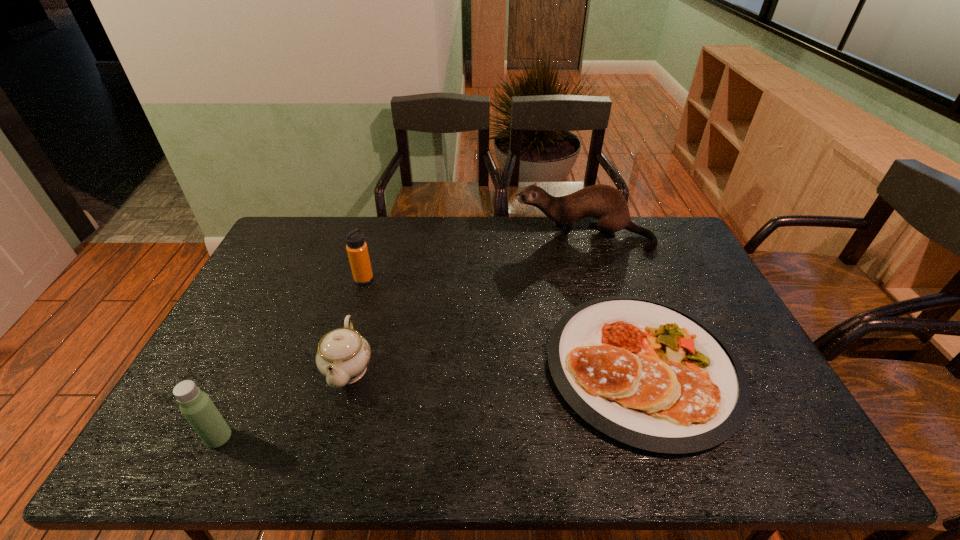
Identify the location of free point between the leftmost object and the ferret. (401, 336).

Locate an element on the screen. The height and width of the screenshot is (540, 960). vacant region between the leftmost object and the shortest object is located at coordinates (430, 402).

The height and width of the screenshot is (540, 960). I want to click on free spot between the chinaware and the nearer thermos bottle, so click(x=283, y=402).

The height and width of the screenshot is (540, 960). I want to click on unoccupied area between the leftmost object and the ferret, so click(401, 336).

Where is `free space between the ferret and the right thermos bottle`? This screenshot has width=960, height=540. free space between the ferret and the right thermos bottle is located at coordinates (473, 258).

Locate an element on the screen. object identified as the third closest to the farthest object is located at coordinates (343, 355).

In order to click on object that is the second closest to the right thermos bottle in this screenshot , I will do `click(603, 202)`.

The width and height of the screenshot is (960, 540). I want to click on free space in the image that satisfies the following two spatial constraints: 1. at the face of the ferret; 2. at the spout of the fourth tallest object, so click(x=623, y=368).

Locate an element on the screen. The width and height of the screenshot is (960, 540). vacant region that satisfies the following two spatial constraints: 1. at the face of the shortest object; 2. on the left side of the ferret is located at coordinates (623, 367).